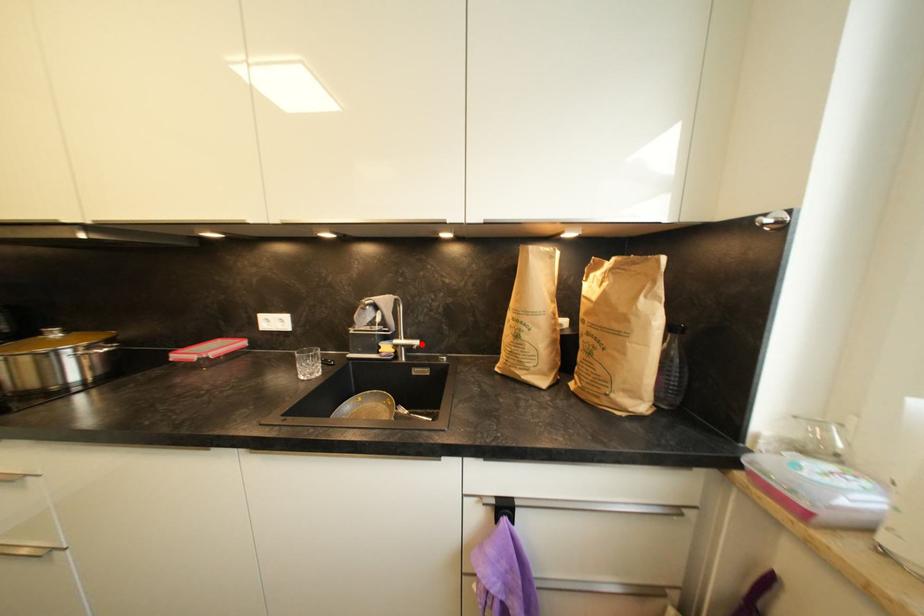
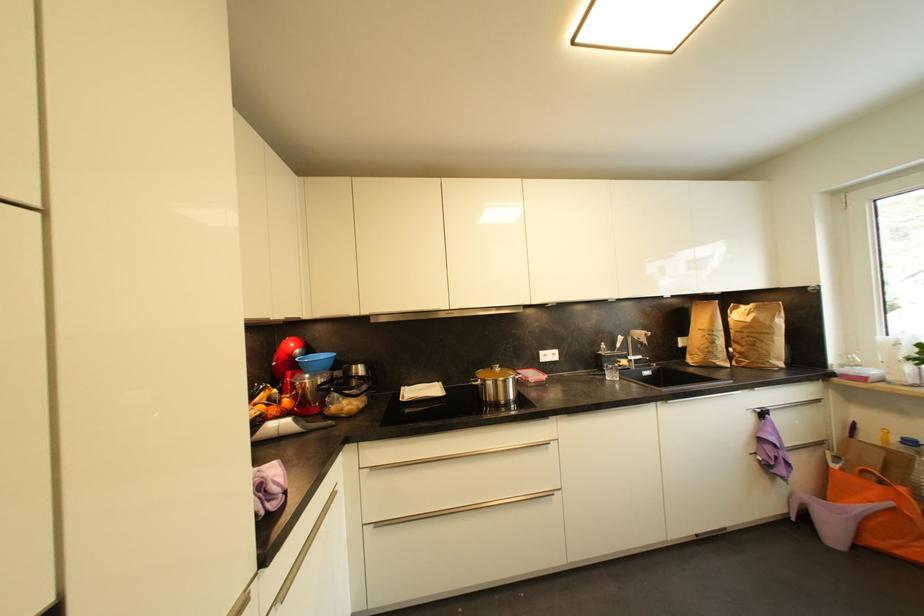
In the second image, find the point that corresponds to the highlighted location in the first image.

(645, 359)